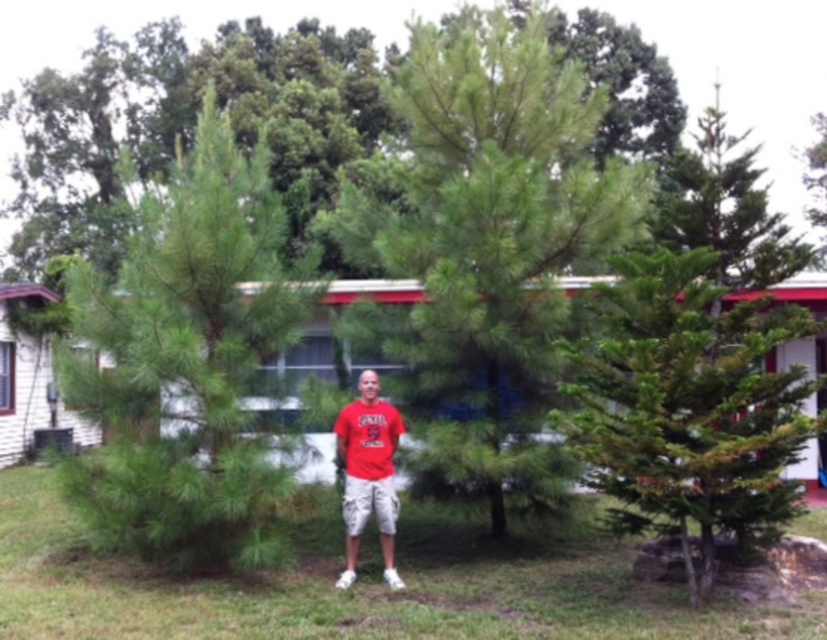
Is green needle-like tree at center below green needle-like at right?

Actually, green needle-like tree at center is above green needle-like at right.

Identify the location of green needle-like tree at center. The image size is (827, 640). (486, 243).

Can you confirm if green needle-like tree at center is taller than green needle-like at center?

In fact, green needle-like tree at center may be shorter than green needle-like at center.

Is green needle-like tree at center above green needle-like at center?

Indeed, green needle-like tree at center is positioned over green needle-like at center.

Where is `green needle-like tree at center`? The width and height of the screenshot is (827, 640). green needle-like tree at center is located at coordinates (486, 243).

Consider the image. Who is positioned more to the left, green needle-like at center or red cotton t-shirt at center?

green needle-like at center is more to the left.

Can you confirm if green needle-like at center is positioned below red cotton t-shirt at center?

No, green needle-like at center is not below red cotton t-shirt at center.

Which is in front, point (265, 522) or point (390, 566)?

Point (265, 522) is more forward.

Where is `green needle-like at center`? The width and height of the screenshot is (827, 640). green needle-like at center is located at coordinates (185, 362).